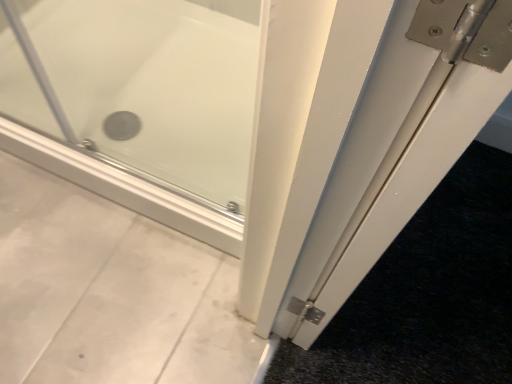
What do you see at coordinates (399, 145) in the screenshot? I see `white matte door at lower right` at bounding box center [399, 145].

Find the location of a particular element. The image size is (512, 384). white matte door at lower right is located at coordinates (399, 145).

Measure the distance between point (387, 245) and camera.

A distance of 23.46 inches exists between point (387, 245) and camera.

This screenshot has height=384, width=512. Find the location of `white matte door at lower right`. white matte door at lower right is located at coordinates (399, 145).